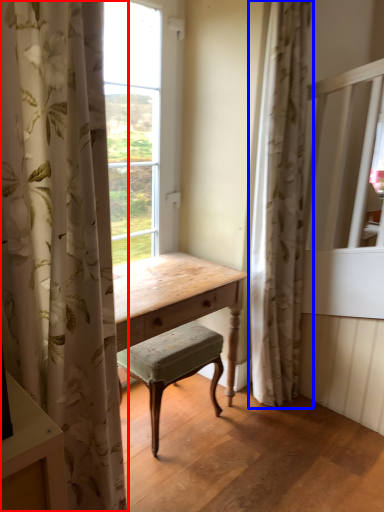
Question: Among these objects, which one is farthest to the camera, curtain (highlighted by a red box) or curtain (highlighted by a blue box)?

Choices:
 (A) curtain
 (B) curtain

Answer: (B)